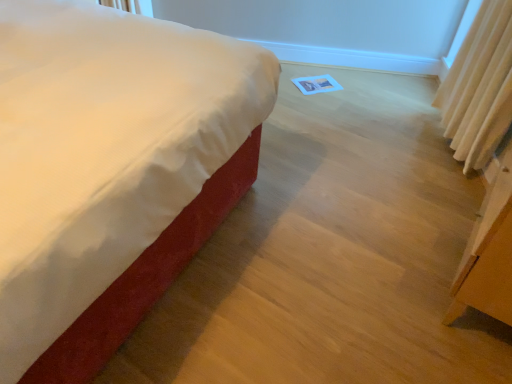
Locate an element on the screen. vacant space in beige fabric curtain at right (from a real-world perspective) is located at coordinates (445, 158).